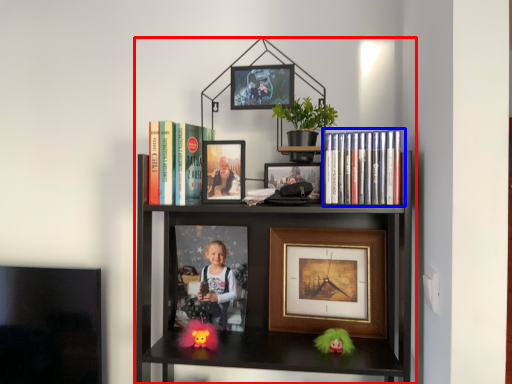
Question: Which object appears farthest to the camera in this image, bookcase (highlighted by a red box) or book (highlighted by a blue box)?

Choices:
 (A) bookcase
 (B) book

Answer: (B)